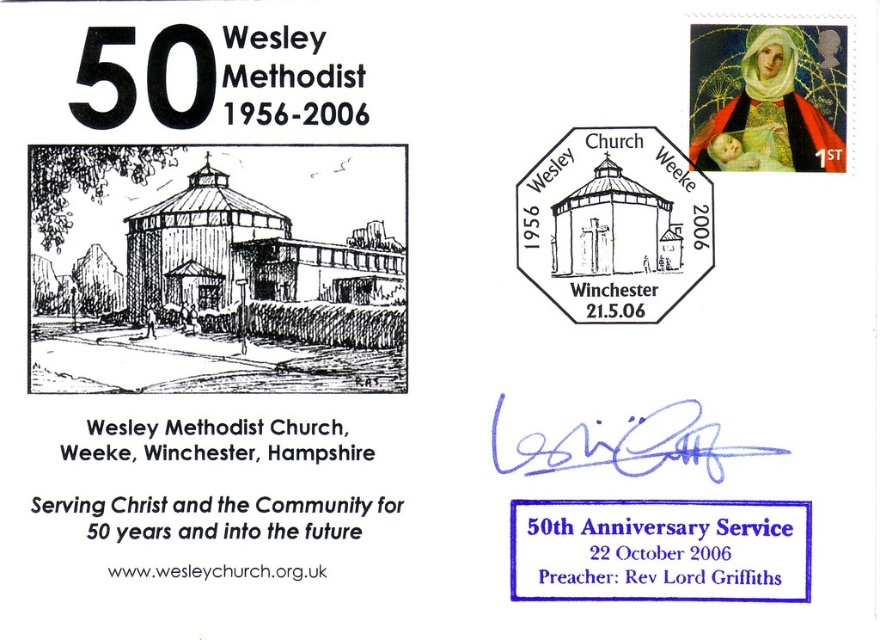
You are examining the postcard and notice the white paper stamp at upper center and the blue ink signature at center. Which one appears closer to you?

The white paper stamp at upper center appears closer because the blue ink signature at center is behind it.

You are examining the postcard and notice the white paper stamp at upper center and the blue ink signature at center. Which of these two items is positioned more to the left on the postcard?

The white paper stamp at upper center is positioned more to the left than the blue ink signature at center according to the description.